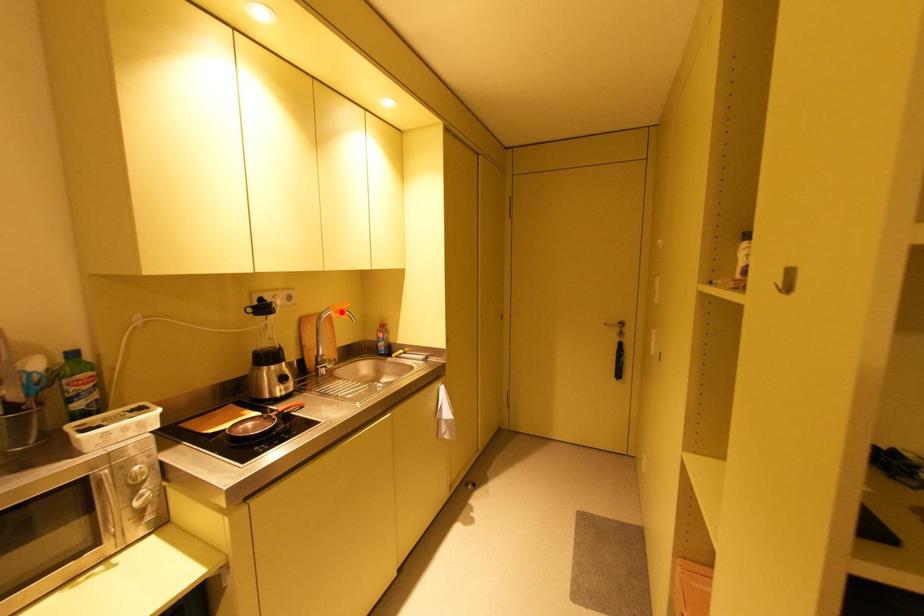
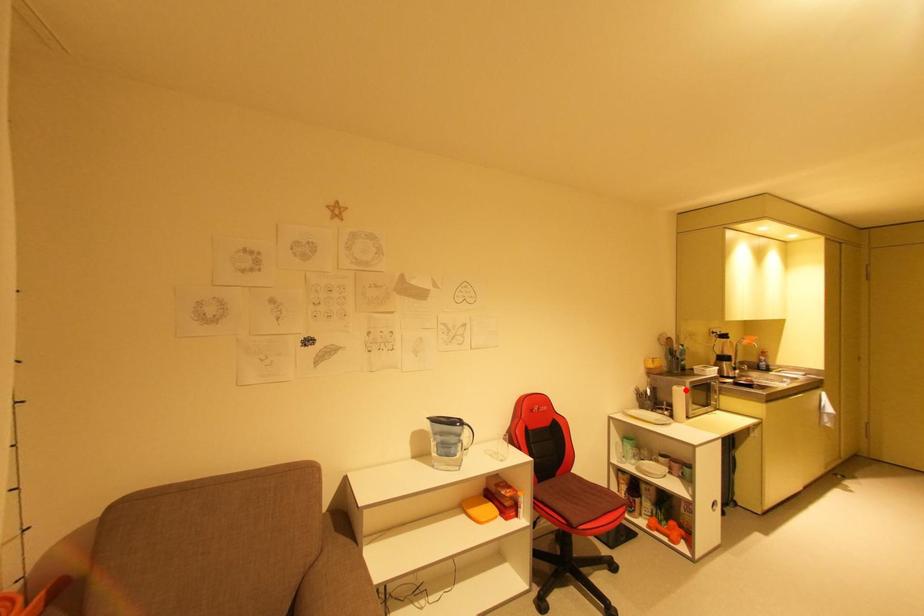
I am providing you with two images of the same scene from different viewpoints. A red point is marked on the first image and another point is marked on the second image. Is the red point in image1 aligned with the point shown in image2?

No